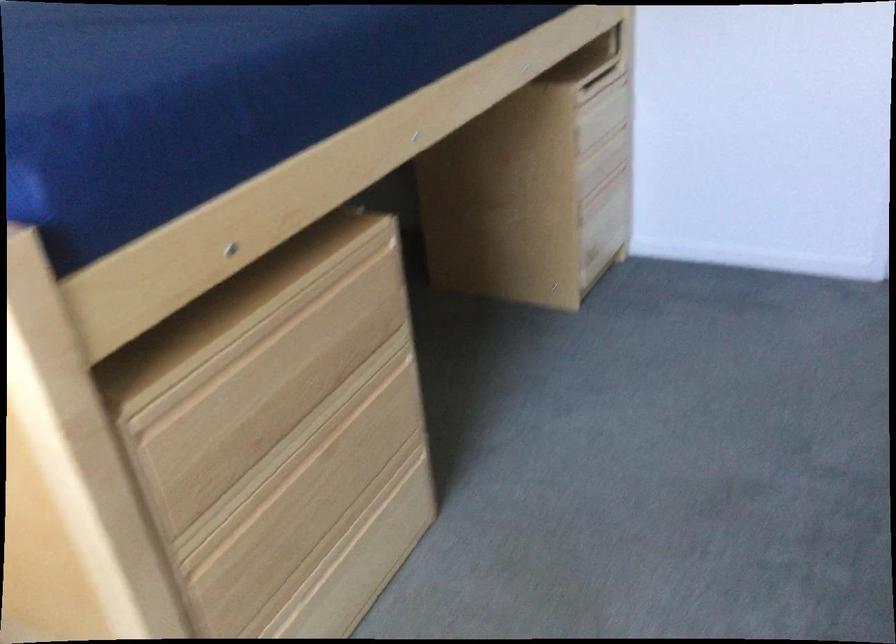
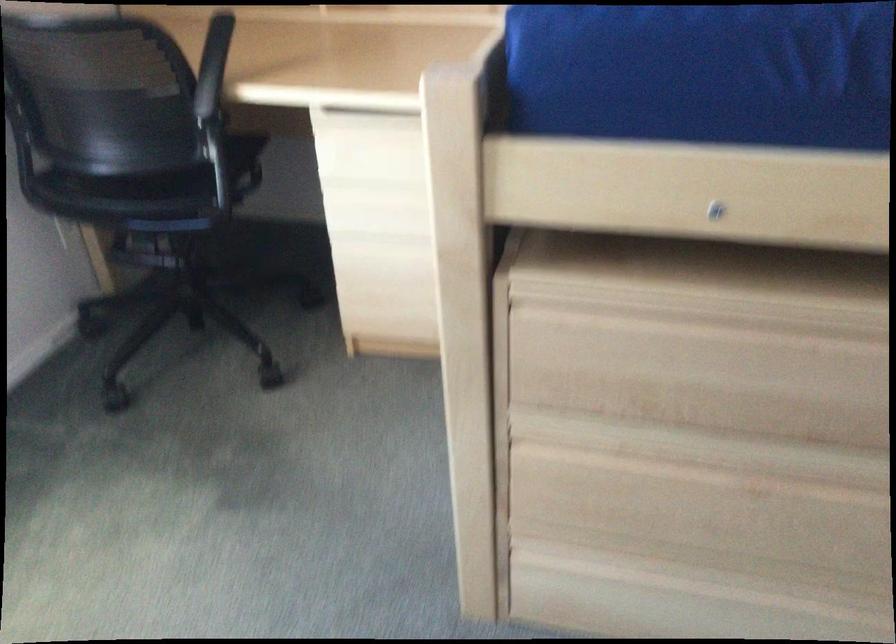
Locate, in the second image, the point that corresponds to pixel 328 552 in the first image.

(705, 582)